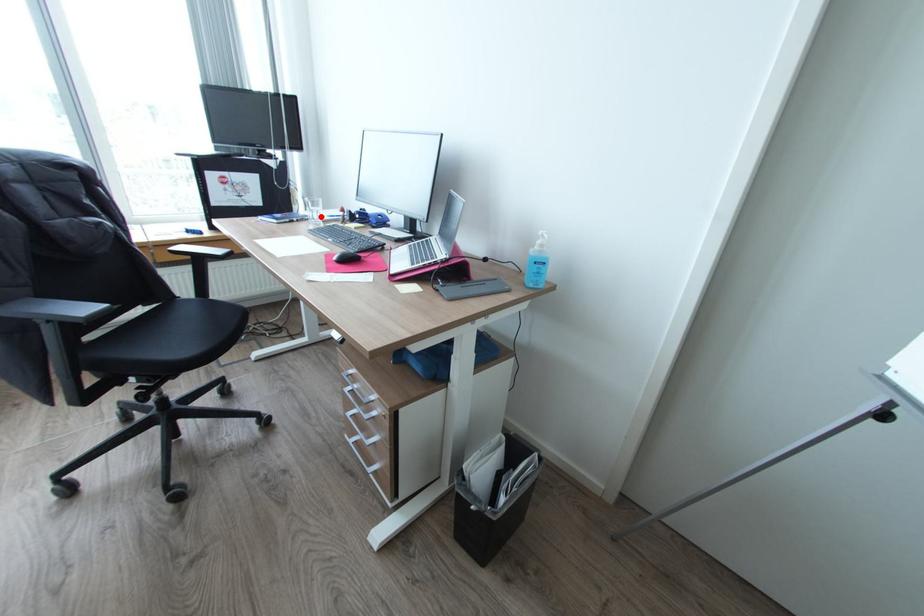
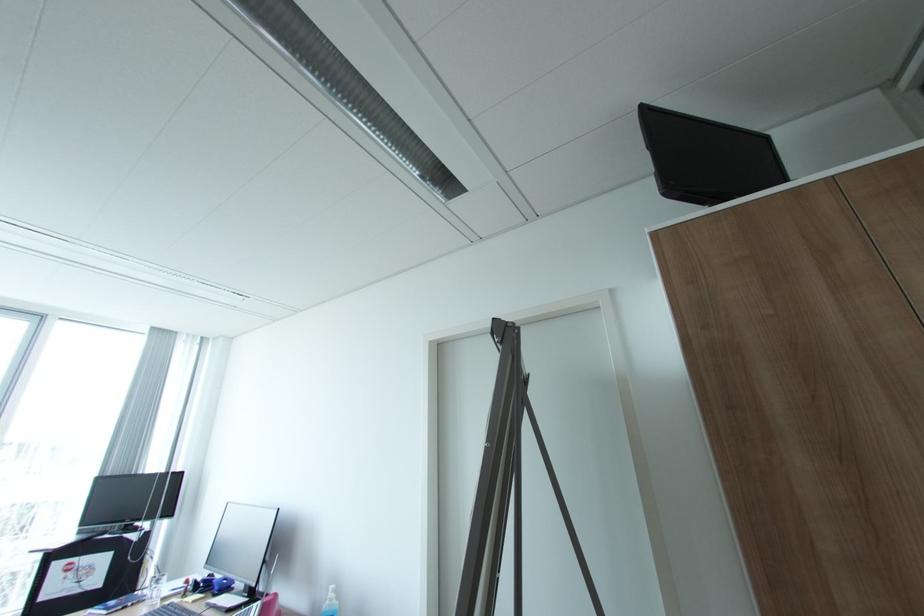
Question: I am providing you with two images of the same scene from different viewpoints. Given a red point in image1, look at the same physical point in image2. Is it:

Choices:
 (A) Closer to the viewpoint
 (B) Farther from the viewpoint

Answer: (A)